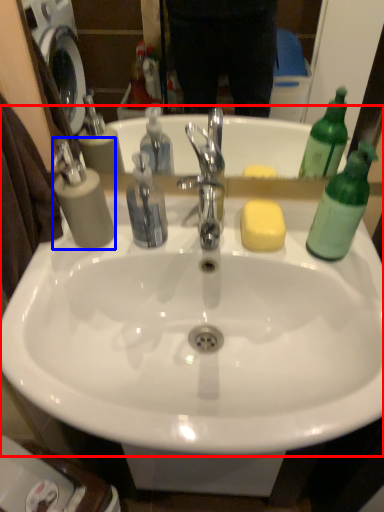
Question: Among these objects, which one is nearest to the camera, sink (highlighted by a red box) or soap dispenser (highlighted by a blue box)?

Choices:
 (A) sink
 (B) soap dispenser

Answer: (A)